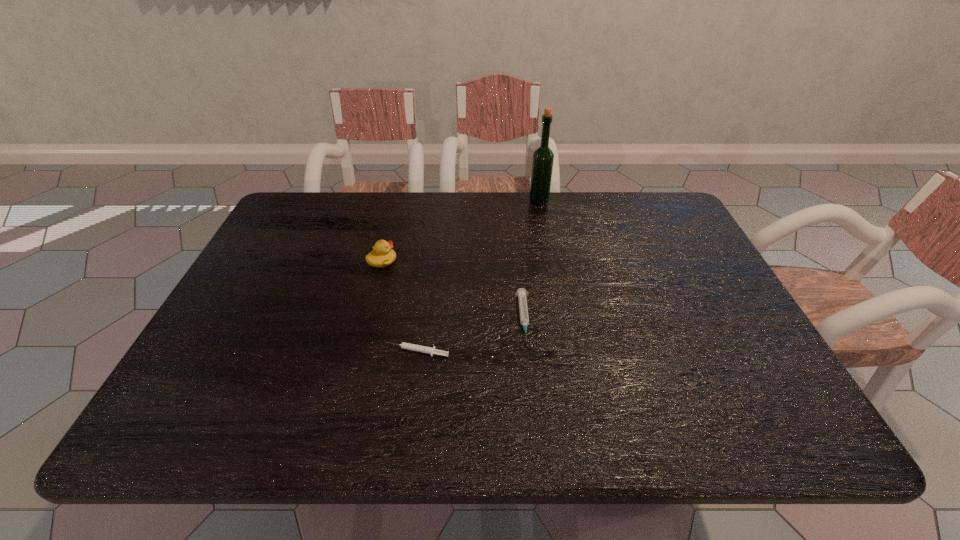
Locate an element on the screen. This screenshot has width=960, height=540. liquor is located at coordinates (542, 164).

Find the location of a particular element. the rightmost object is located at coordinates (542, 164).

Locate an element on the screen. The width and height of the screenshot is (960, 540). the third shortest object is located at coordinates (382, 255).

Where is `the leftmost object`? Image resolution: width=960 pixels, height=540 pixels. the leftmost object is located at coordinates (382, 255).

In order to click on the right syringe in this screenshot , I will do `click(521, 293)`.

In order to click on the second object from right to left in this screenshot , I will do `click(521, 293)`.

Find the location of a particular element. This screenshot has height=540, width=960. the second object from left to right is located at coordinates (408, 346).

At what (x,y) coordinates should I click in order to perform the action: click on the shortest object. Please return your answer as a coordinate pair (x, y). This screenshot has width=960, height=540. Looking at the image, I should click on (408, 346).

Locate an element on the screen. vacant point located on the front of the rightmost object is located at coordinates (542, 220).

Identify the location of vacant space situated on the beak of the second tallest object. (514, 261).